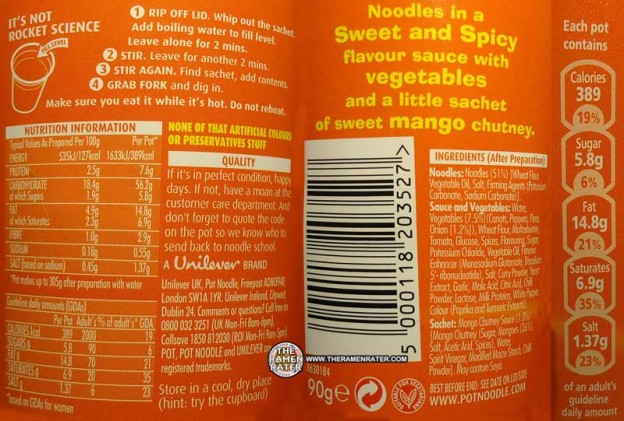
Locate an element on the screen. The height and width of the screenshot is (421, 624). inside of the cup on the upper left is located at coordinates (39, 71).